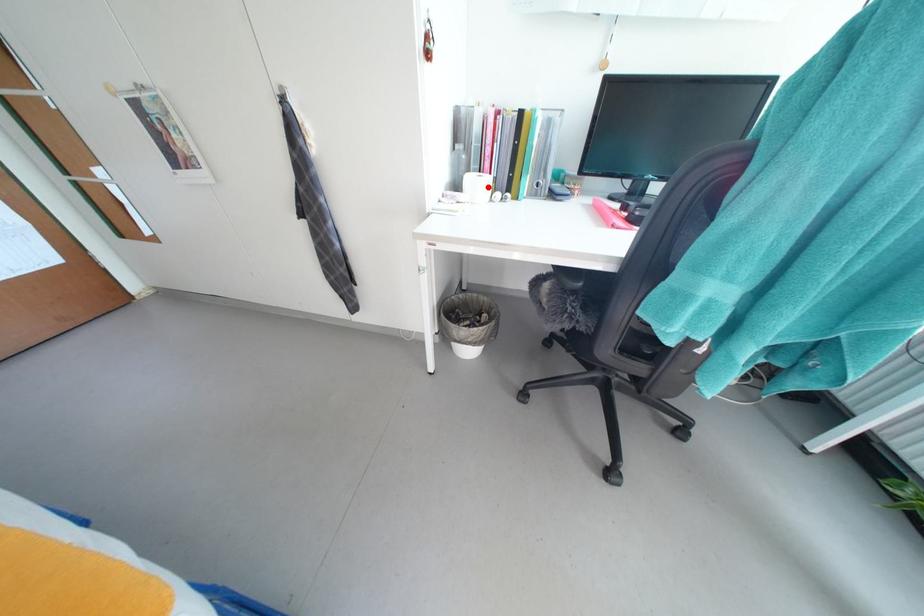
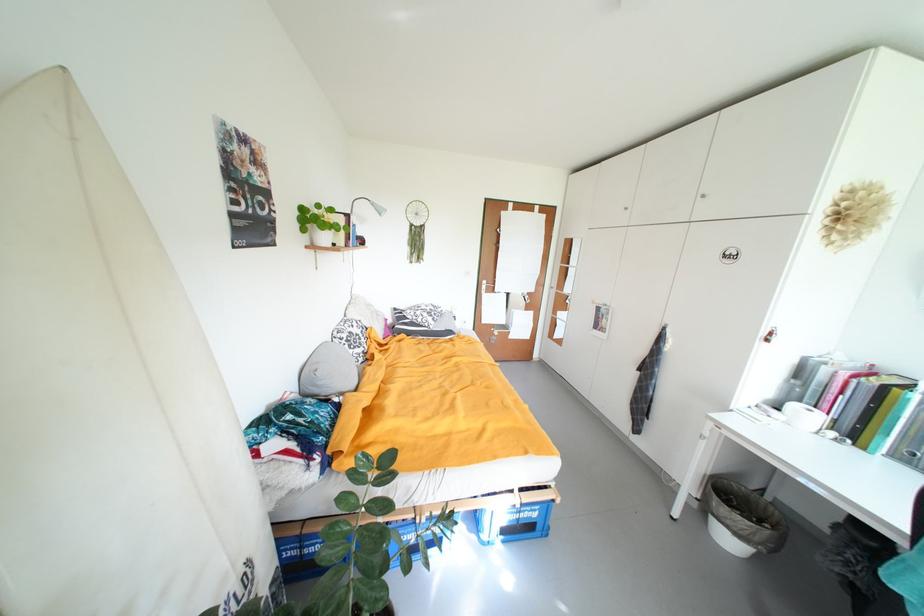
In the second image, find the point that corresponds to the highlighted location in the first image.

(817, 419)